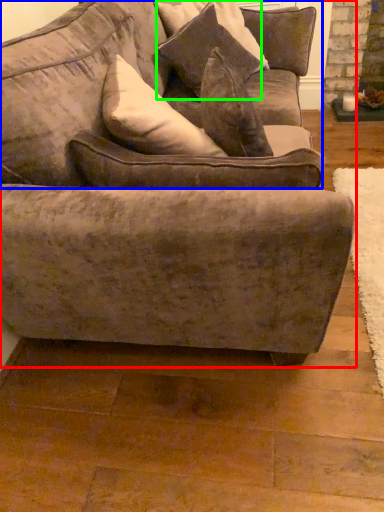
Question: Which is nearer to the studio couch (highlighted by a red box)? couch (highlighted by a blue box) or pillow (highlighted by a green box).

Choices:
 (A) couch
 (B) pillow

Answer: (A)